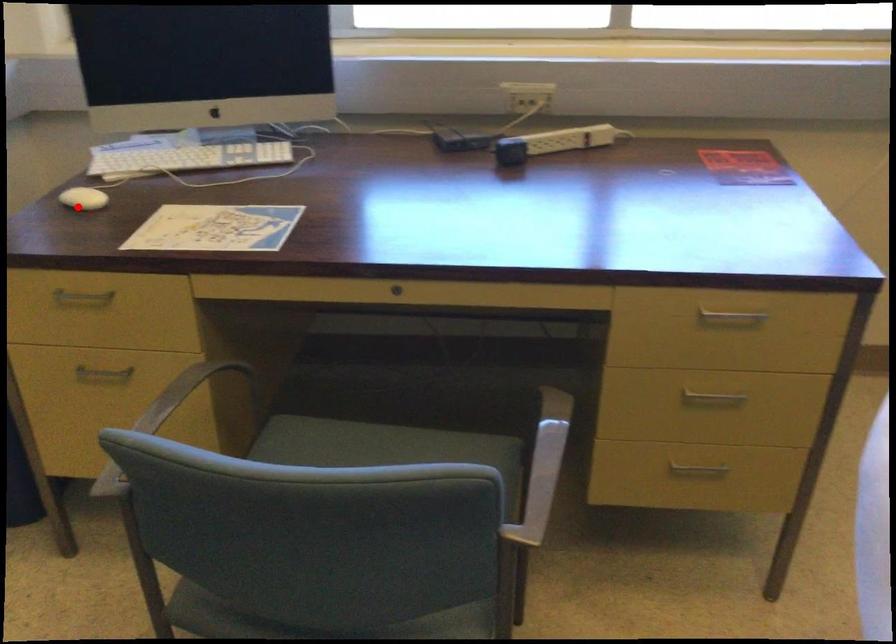
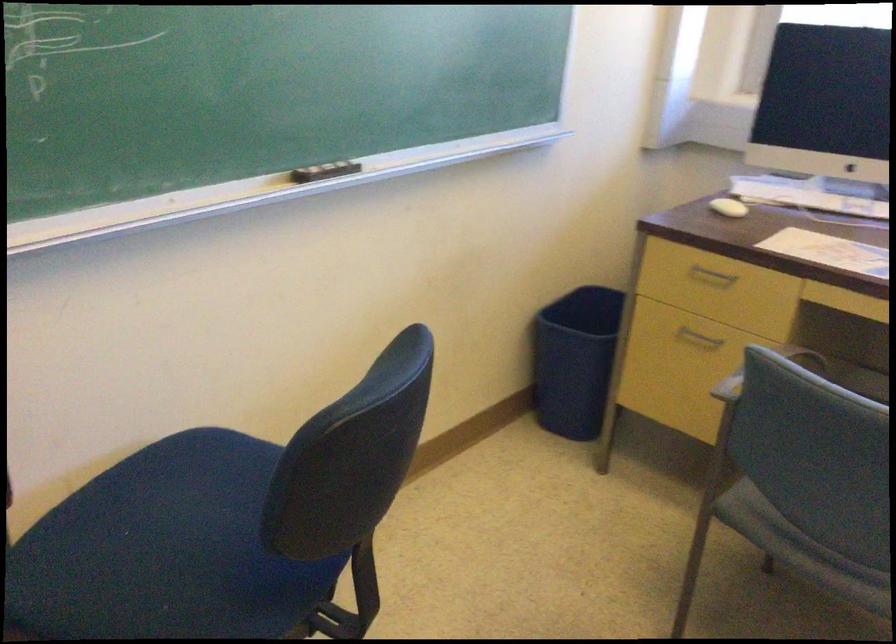
Find the pixel in the second image that matches the highlighted location in the first image.

(728, 207)